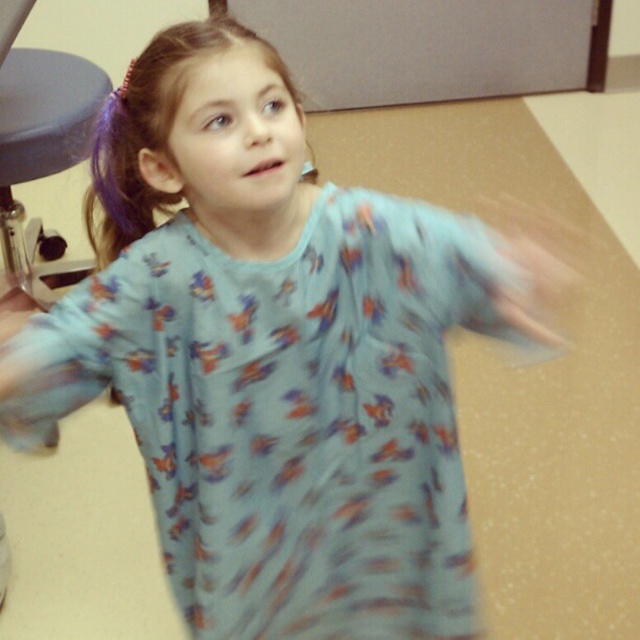
You are taking a photo of the girl and need to focus on both the point at (128, 172) and the point at (42, 451). Which point is closer to the camera?

Point at (128, 172) is further to the camera than point at (42, 451), so the point at (42, 451) is closer to the camera.

The young girl in the scene has two distinct features visible in the image. Can you determine which one is positioned higher up between the purple silky hair at upper left and the matte skin hand at lower left?

The purple silky hair at upper left is positioned higher up than the matte skin hand at lower left.

You are a person who wants to sit down. You see the matte gray swivel chair at left and the matte skin hand at lower left. Which object is closer to you so you can reach it first?

The matte gray swivel chair at left is closer to you than the matte skin hand at lower left, so you can reach it first.